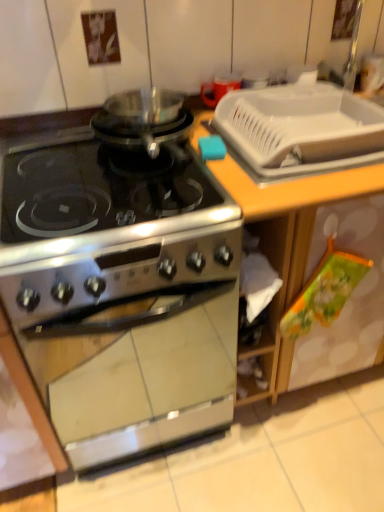
Question: Is wooden countertop at center facing away from white plastic tray at upper right?

Choices:
 (A) no
 (B) yes

Answer: (A)

Question: Would you say white plastic tray at upper right is part of wooden countertop at center's contents?

Choices:
 (A) no
 (B) yes

Answer: (B)

Question: Is wooden countertop at center outside white plastic tray at upper right?

Choices:
 (A) no
 (B) yes

Answer: (B)

Question: From the image's perspective, would you say wooden countertop at center is shown under white plastic tray at upper right?

Choices:
 (A) yes
 (B) no

Answer: (A)

Question: From a real-world perspective, is wooden countertop at center positioned over white plastic tray at upper right based on gravity?

Choices:
 (A) yes
 (B) no

Answer: (B)

Question: Looking at their shapes, would you say satin silver gas stove at center is wider or thinner than wooden countertop at center?

Choices:
 (A) thin
 (B) wide

Answer: (A)

Question: In terms of size, does satin silver gas stove at center appear bigger or smaller than wooden countertop at center?

Choices:
 (A) big
 (B) small

Answer: (B)

Question: Considering the positions of satin silver gas stove at center and wooden countertop at center in the image, is satin silver gas stove at center taller or shorter than wooden countertop at center?

Choices:
 (A) tall
 (B) short

Answer: (B)

Question: Would you say satin silver gas stove at center is inside or outside wooden countertop at center?

Choices:
 (A) inside
 (B) outside

Answer: (B)

Question: Is point (279, 161) positioned closer to the camera than point (77, 167)?

Choices:
 (A) farther
 (B) closer

Answer: (B)

Question: From a real-world perspective, is white plastic sink at upper right above or below stainless steel stove at center?

Choices:
 (A) above
 (B) below

Answer: (A)

Question: From the image's perspective, relative to stainless steel stove at center, is white plastic sink at upper right above or below?

Choices:
 (A) above
 (B) below

Answer: (A)

Question: In terms of width, does white plastic sink at upper right look wider or thinner when compared to stainless steel stove at center?

Choices:
 (A) thin
 (B) wide

Answer: (A)

Question: Is wooden countertop at center inside the boundaries of white plastic sink at upper right, or outside?

Choices:
 (A) outside
 (B) inside

Answer: (A)

Question: Considering the relative positions of wooden countertop at center and white plastic sink at upper right in the image provided, is wooden countertop at center to the left or to the right of white plastic sink at upper right?

Choices:
 (A) left
 (B) right

Answer: (B)